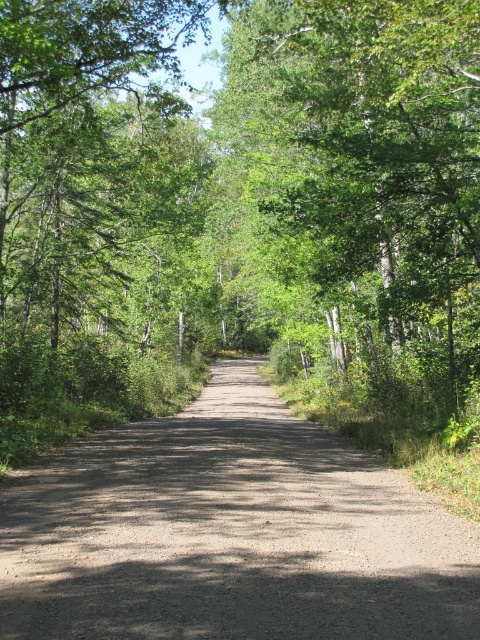
Question: Is green leafy tree at center further to the viewer compared to dirt/gravel road at center?

Choices:
 (A) yes
 (B) no

Answer: (A)

Question: Is green leafy tree at center below dirt/gravel road at center?

Choices:
 (A) yes
 (B) no

Answer: (B)

Question: From the image, what is the correct spatial relationship of green leafy tree at center in relation to dirt/gravel road at center?

Choices:
 (A) right
 (B) left

Answer: (B)

Question: Which of the following is the farthest from the observer?

Choices:
 (A) green leafy tree at center
 (B) dirt/gravel road at center

Answer: (A)